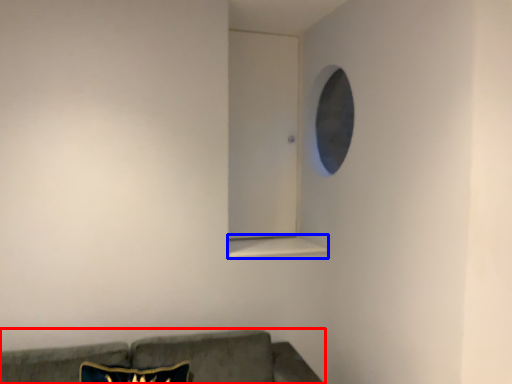
Question: Among these objects, which one is farthest to the camera, studio couch (highlighted by a red box) or window sill (highlighted by a blue box)?

Choices:
 (A) studio couch
 (B) window sill

Answer: (B)